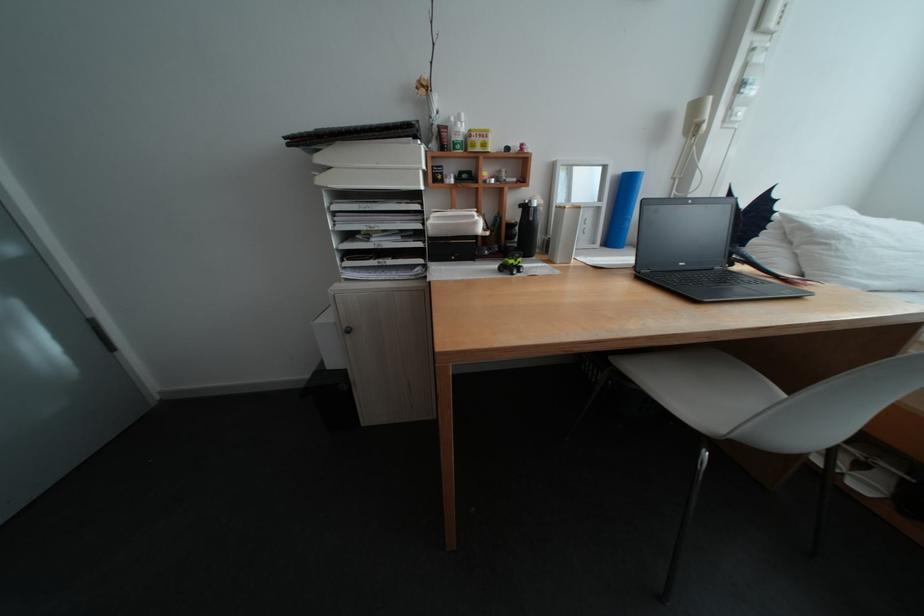
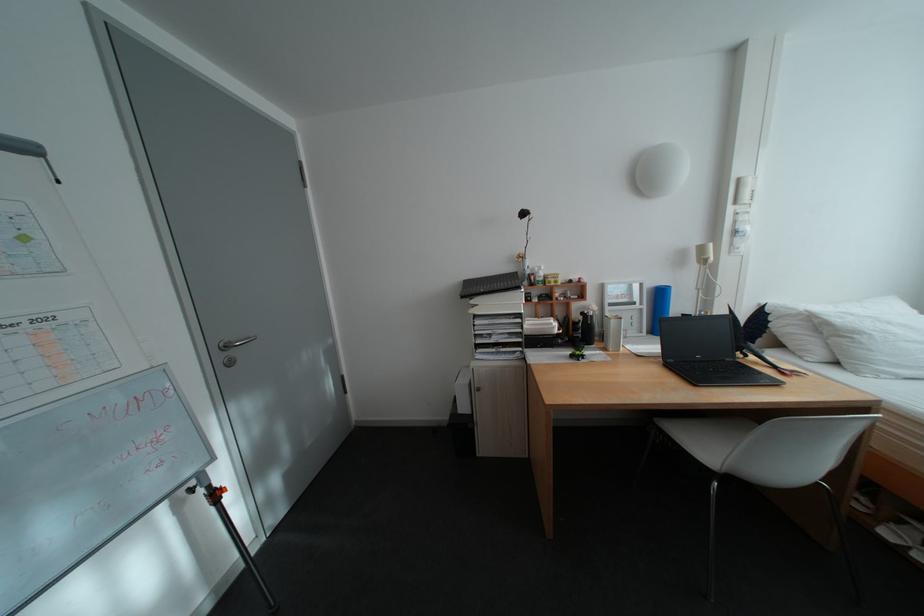
Where in the second image is the point corresponding to point (616, 205) from the first image?

(657, 307)